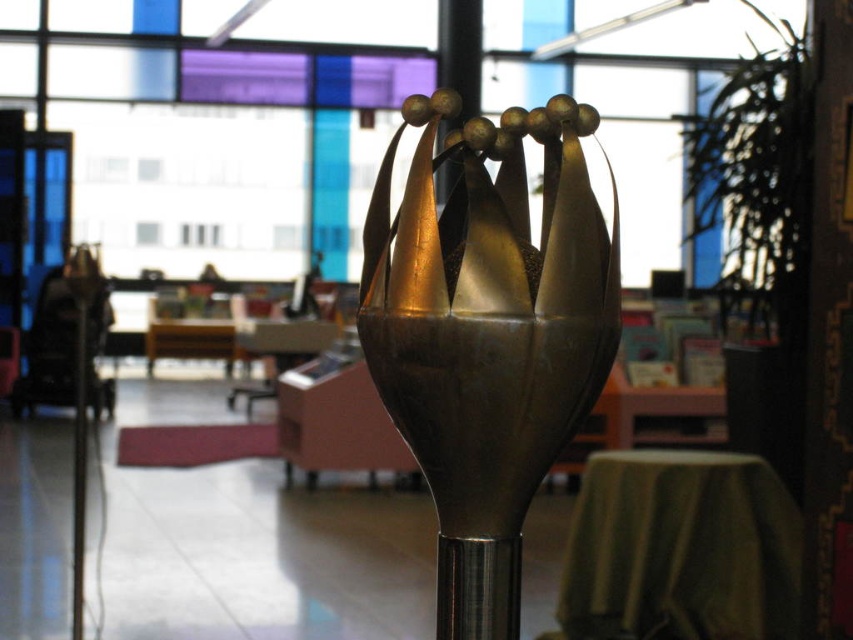
Question: Is gold polished metal crown at center to the left of green fabric table at center from the viewer's perspective?

Choices:
 (A) yes
 (B) no

Answer: (A)

Question: Which point is closer to the camera taking this photo?

Choices:
 (A) (341, 384)
 (B) (791, 547)

Answer: (A)

Question: Is green fabric table at center to the right of pink matte table at center from the viewer's perspective?

Choices:
 (A) no
 (B) yes

Answer: (B)

Question: Among these points, which one is nearest to the camera?

Choices:
 (A) (601, 323)
 (B) (717, 554)
 (C) (358, 460)
 (D) (80, 477)

Answer: (A)

Question: Does gold polished metal crown at center appear on the left side of green fabric table at center?

Choices:
 (A) no
 (B) yes

Answer: (B)

Question: Which object is positioned closest to the gold polished metal crown at center?

Choices:
 (A) green fabric table at center
 (B) metallic pole at center
 (C) pink matte table at center

Answer: (B)